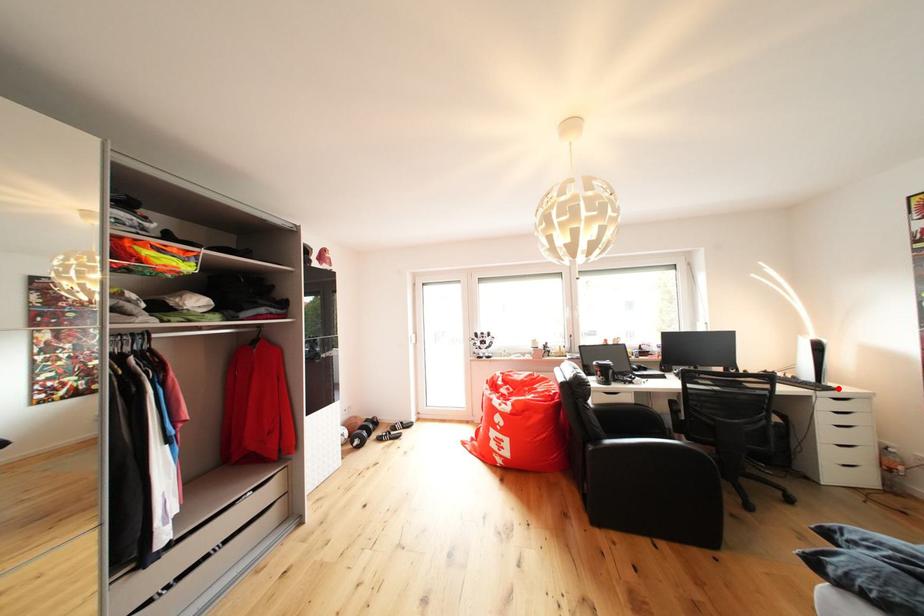
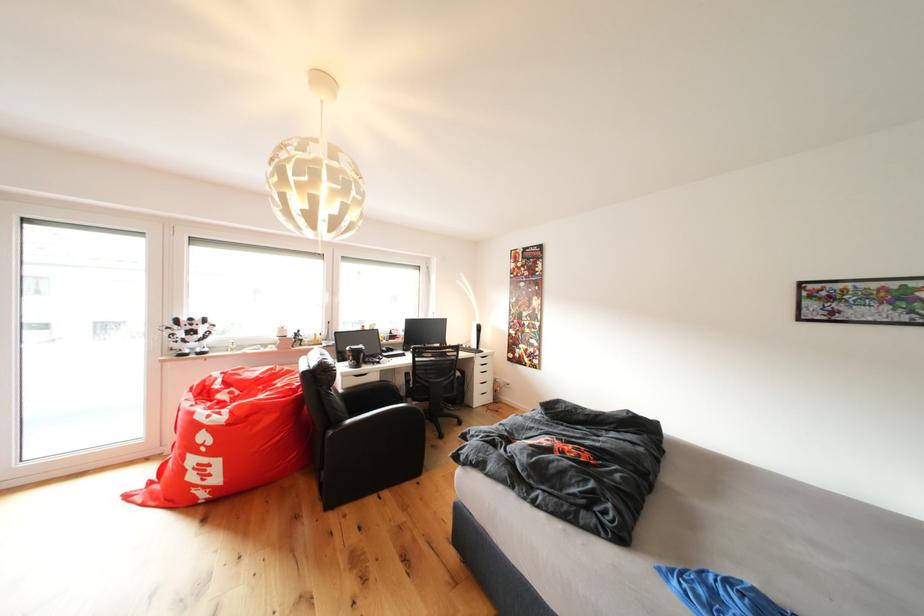
Where in the second image is the point corresponding to the highlighted location from the first image?

(490, 354)